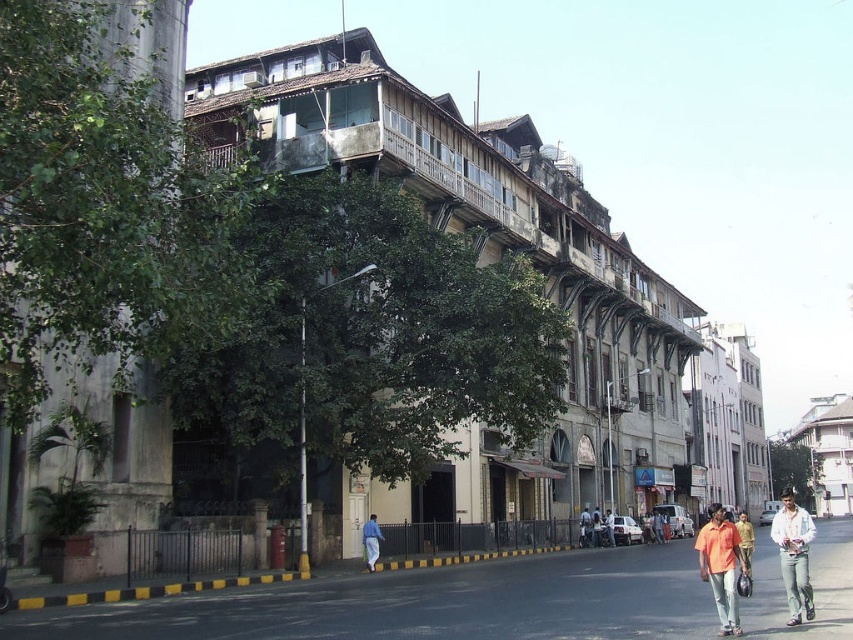
You are standing at the base of the building and notice two points marked on the facade. The first point is at coordinate point [363,541] and the second is at point [596,515]. Which point is closer to your current position?

Point [363,541] is in front of point [596,515], so it is closer to your current position at the base of the building.

You are a fashion designer observing a street scene in an urban area. You notice a person wearing blue jeans at lower center and an orange shirt at center. Which clothing item appears smaller in size?

The blue jeans at lower center appears smaller in size than the orange shirt at center according to the description.

You are a delivery person standing on the black asphalt pavement at lower center and the blue jeans at lower center. Which surface can you stand on for a longer period without getting tired?

The black asphalt pavement at lower center is larger in size than blue jeans at lower center, so it provides a more stable and comfortable surface to stand on for a longer period without getting tired.